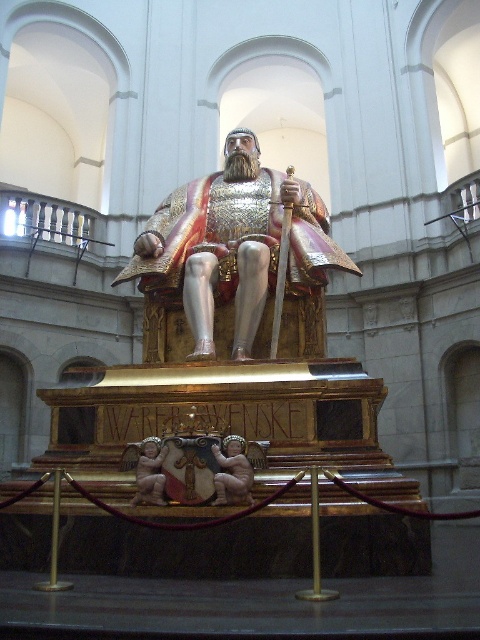
You are an art conservator working on restoring the statue. You need to place a protective barrier around the statue to prevent visitors from touching it. The barrier must be placed at least 2 meters away from the polished bronze cherub at center. Where should you position the barrier relative to the statue?

The barrier should be placed at least 2 meters away from the polished bronze cherub at center, which is located at point (x=232, y=472). Since the cherub is at the center, positioning the barrier 2 meters away from this point would ensure it is safely distant from the statue while keeping visitors at a safe viewing distance.

You are an art conservator tasked with measuring the width of the shiny gold armor at center and the polished bronze cherub at center. Which object do you think has a greater width?

The shiny gold armor at center might be wider than polished bronze cherub at center according to the description.